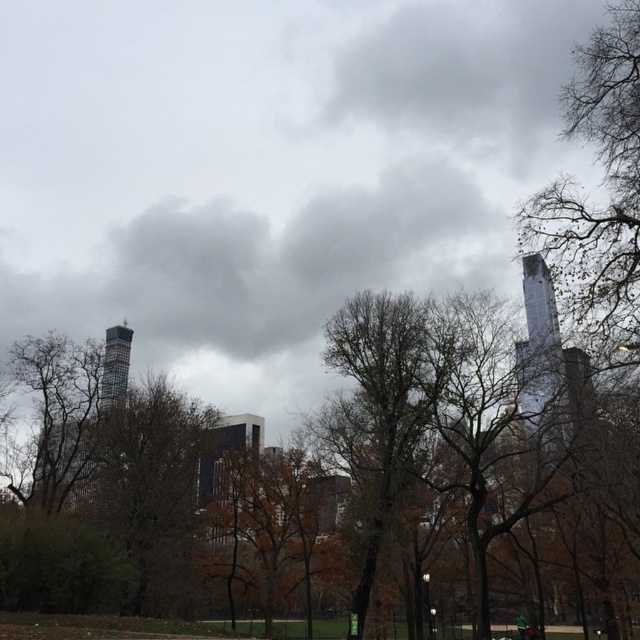
Can you confirm if brown matte tree at center is positioned to the right of glassy reflective skyscraper at right?

No, brown matte tree at center is not to the right of glassy reflective skyscraper at right.

Is point (317, 513) farther from camera compared to point (541, 406)?

Yes, it is.

Identify the location of brown matte tree at center. (269, 525).

Can you confirm if glassy reflective skyscraper at center is smaller than shiny glass tower at center?

Yes.

Measure the distance between glassy reflective skyscraper at center and shiny glass tower at center.

7.63 meters

Image resolution: width=640 pixels, height=640 pixels. What do you see at coordinates (225, 454) in the screenshot?
I see `glassy reflective skyscraper at center` at bounding box center [225, 454].

You are a GUI agent. You are given a task and a screenshot of the screen. Output one action in this format:
    pyautogui.click(x=<x>, y=<y>)
    Task: Click on the glassy reflective skyscraper at center
    The width and height of the screenshot is (640, 640).
    Given the screenshot: What is the action you would take?
    pyautogui.click(x=225, y=454)

Can you confirm if glassy reflective skyscraper at right is positioned to the left of glassy reflective skyscraper at center?

No, glassy reflective skyscraper at right is not to the left of glassy reflective skyscraper at center.

In the scene shown: Can you confirm if glassy reflective skyscraper at right is wider than glassy reflective skyscraper at center?

Indeed, glassy reflective skyscraper at right has a greater width compared to glassy reflective skyscraper at center.

Is point (541, 401) positioned behind point (221, 429)?

That is False.

I want to click on glassy reflective skyscraper at right, so click(x=541, y=356).